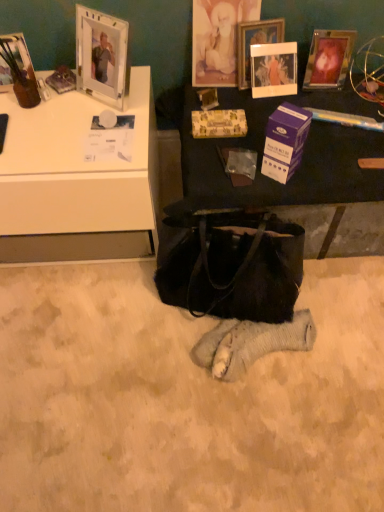
I want to click on free space in front of gold-patterned paper at center, so click(222, 161).